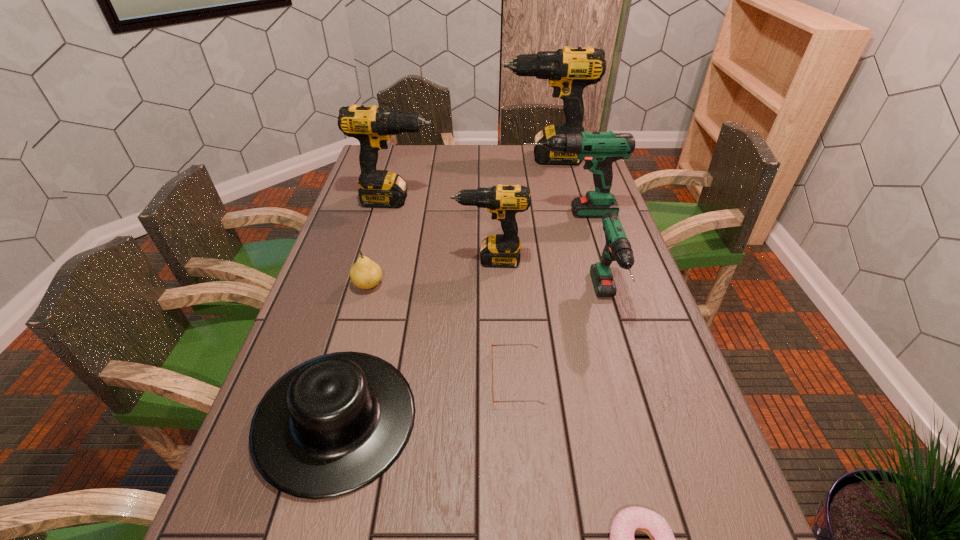
Identify the location of vacant space located at the tip of the fourth farthest drill. The height and width of the screenshot is (540, 960). (426, 260).

You are a GUI agent. You are given a task and a screenshot of the screen. Output one action in this format:
    pyautogui.click(x=<x>, y=<y>)
    Task: Click on the free region located at the tip of the fourth farthest drill
    Image resolution: width=960 pixels, height=540 pixels.
    Given the screenshot: What is the action you would take?
    pyautogui.click(x=367, y=260)

Identify the location of vacant space located 0.340m on the handle side of the fifth tallest object. This screenshot has height=540, width=960. (659, 475).

This screenshot has height=540, width=960. In order to click on free point located on the right of the black dress hat in this screenshot , I will do `click(439, 419)`.

This screenshot has width=960, height=540. I want to click on vacant space located on the back of the pear, so click(383, 231).

Where is `free location located on the face of the sunglasses`? Image resolution: width=960 pixels, height=540 pixels. free location located on the face of the sunglasses is located at coordinates (317, 378).

Where is `vacant position located on the face of the sunglasses`? vacant position located on the face of the sunglasses is located at coordinates (466, 378).

The width and height of the screenshot is (960, 540). I want to click on vacant space located on the face of the sunglasses, so click(x=335, y=378).

What are the coordinates of `object at the far edge` in the screenshot? It's located at (569, 70).

Find the location of `drill present at the left edge`. drill present at the left edge is located at coordinates (372, 126).